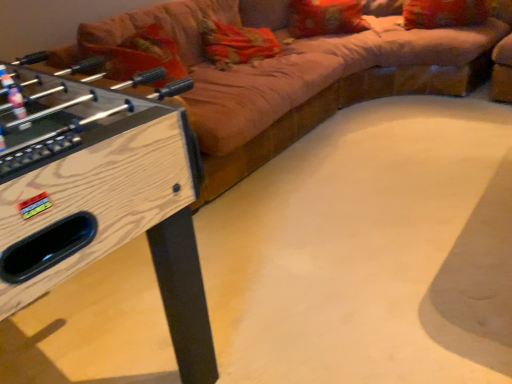
Question: Is velvet beige couch at upper center next to velvet-like red pillow at upper right, which ranks as the 2th pillow in left-to-right order, and touching it?

Choices:
 (A) yes
 (B) no

Answer: (B)

Question: Is velvet beige couch at upper center far from velvet-like red pillow at upper right, arranged as the first pillow when viewed from the right?

Choices:
 (A) yes
 (B) no

Answer: (B)

Question: Considering the relative positions of velvet beige couch at upper center and velvet-like red pillow at upper right, which ranks as the 2th pillow in left-to-right order, in the image provided, is velvet beige couch at upper center to the left of velvet-like red pillow at upper right, which ranks as the 2th pillow in left-to-right order, from the viewer's perspective?

Choices:
 (A) no
 (B) yes

Answer: (B)

Question: From the image's perspective, would you say velvet beige couch at upper center is positioned over velvet-like red pillow at upper right, arranged as the first pillow when viewed from the right?

Choices:
 (A) yes
 (B) no

Answer: (B)

Question: Considering the relative sizes of velvet beige couch at upper center and velvet-like red pillow at upper right, which ranks as the 2th pillow in left-to-right order, in the image provided, is velvet beige couch at upper center taller than velvet-like red pillow at upper right, which ranks as the 2th pillow in left-to-right order,?

Choices:
 (A) yes
 (B) no

Answer: (A)

Question: Considering the positions of point (129, 170) and point (333, 4), is point (129, 170) closer or farther from the camera than point (333, 4)?

Choices:
 (A) farther
 (B) closer

Answer: (B)

Question: In the image, is wooden foosball table at left on the left side or the right side of orange fabric pillow at upper center, the first pillow in the left-to-right sequence?

Choices:
 (A) left
 (B) right

Answer: (A)

Question: Considering the positions of wooden foosball table at left and orange fabric pillow at upper center, marked as the second pillow in a right-to-left arrangement, in the image, is wooden foosball table at left taller or shorter than orange fabric pillow at upper center, marked as the second pillow in a right-to-left arrangement,?

Choices:
 (A) short
 (B) tall

Answer: (B)

Question: Considering the positions of wooden foosball table at left and orange fabric pillow at upper center, the first pillow in the left-to-right sequence, in the image, is wooden foosball table at left wider or thinner than orange fabric pillow at upper center, the first pillow in the left-to-right sequence,?

Choices:
 (A) wide
 (B) thin

Answer: (A)

Question: Is velvet-like red pillow at upper right, which ranks as the 2th pillow in left-to-right order, taller or shorter than wooden foosball table at left?

Choices:
 (A) tall
 (B) short

Answer: (B)

Question: Does point (466, 1) appear closer or farther from the camera than point (186, 301)?

Choices:
 (A) farther
 (B) closer

Answer: (A)

Question: In the image, is velvet-like red pillow at upper right, which ranks as the 2th pillow in left-to-right order, on the left side or the right side of wooden foosball table at left?

Choices:
 (A) right
 (B) left

Answer: (A)

Question: Relative to wooden foosball table at left, is velvet-like red pillow at upper right, which ranks as the 2th pillow in left-to-right order, in front or behind?

Choices:
 (A) behind
 (B) front

Answer: (A)

Question: From the image's perspective, relative to velvet-like red pillow at upper right, which ranks as the 2th pillow in left-to-right order, is wooden foosball table at left above or below?

Choices:
 (A) below
 (B) above

Answer: (A)

Question: From a real-world perspective, relative to velvet-like red pillow at upper right, arranged as the first pillow when viewed from the right, is wooden foosball table at left vertically above or below?

Choices:
 (A) above
 (B) below

Answer: (B)